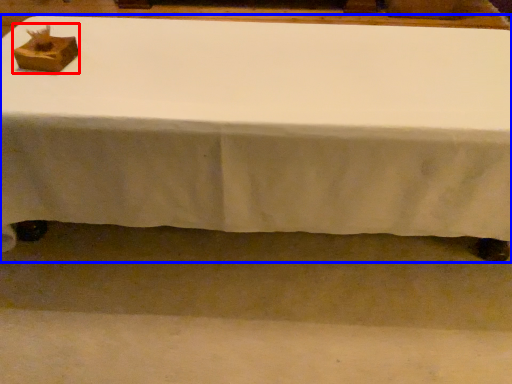
Question: Which point is closer to the camera, shoe box (highlighted by a red box) or table (highlighted by a blue box)?

Choices:
 (A) shoe box
 (B) table

Answer: (B)